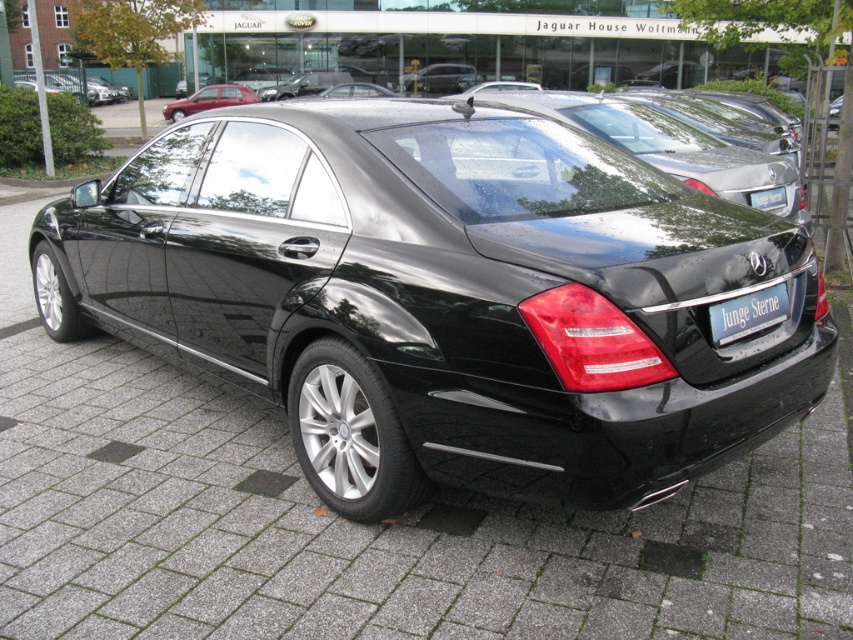
Question: Where is black metallic license plate at rear located in relation to matte red sedan at upper left in the image?

Choices:
 (A) above
 (B) below

Answer: (B)

Question: Which of the following is the farthest from the observer?

Choices:
 (A) (781, 195)
 (B) (212, 86)
 (C) (616, 125)
 (D) (229, 268)

Answer: (B)

Question: Is black metallic license plate at rear further to camera compared to matte red sedan at upper left?

Choices:
 (A) no
 (B) yes

Answer: (A)

Question: Does matte red sedan at upper left lie in front of blue metallic license plate at center?

Choices:
 (A) no
 (B) yes

Answer: (A)

Question: Which of the following is the farthest from the observer?

Choices:
 (A) (775, 198)
 (B) (245, 97)

Answer: (B)

Question: Among these objects, which one is farthest from the camera?

Choices:
 (A) blue metallic license plate at center
 (B) glossy black sedan at center
 (C) black metallic license plate at rear
 (D) black metallic car at center

Answer: (A)